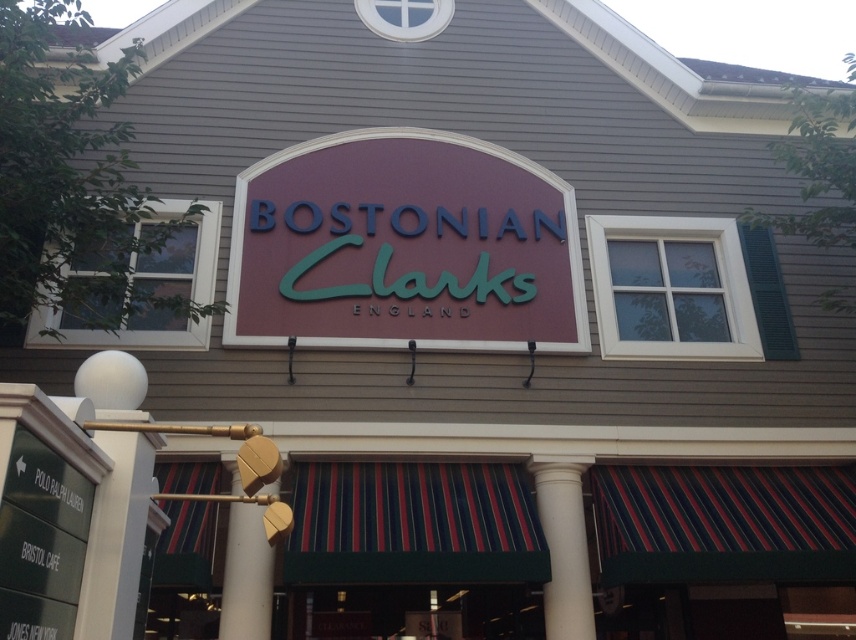
Does white smooth column at center have a larger size compared to wooden at center?

Actually, white smooth column at center might be smaller than wooden at center.

Does white smooth column at center lie in front of wooden at center?

No, white smooth column at center is further to the viewer.

Between point (545, 508) and point (265, 552), which one is positioned in front?

Point (265, 552) is more forward.

The width and height of the screenshot is (856, 640). What are the coordinates of `white smooth column at center` in the screenshot? It's located at (563, 545).

Is point (364, 253) positioned in front of point (260, 620)?

No, it is not.

Who is higher up, matte maroon sign at center or wooden at center?

matte maroon sign at center

Locate an element on the screen. matte maroon sign at center is located at coordinates (403, 248).

At what (x,y) coordinates should I click in order to perform the action: click on matte maroon sign at center. Please return your answer as a coordinate pair (x, y). This screenshot has height=640, width=856. Looking at the image, I should click on (403, 248).

You are a GUI agent. You are given a task and a screenshot of the screen. Output one action in this format:
    pyautogui.click(x=<x>, y=<y>)
    Task: Click on the matte maroon sign at center
    The height and width of the screenshot is (640, 856).
    Given the screenshot: What is the action you would take?
    pyautogui.click(x=403, y=248)

Is point (345, 227) positioned behind point (559, 557)?

Yes, it is behind point (559, 557).

What do you see at coordinates (403, 248) in the screenshot?
I see `matte maroon sign at center` at bounding box center [403, 248].

This screenshot has height=640, width=856. In order to click on matte maroon sign at center in this screenshot , I will do `click(403, 248)`.